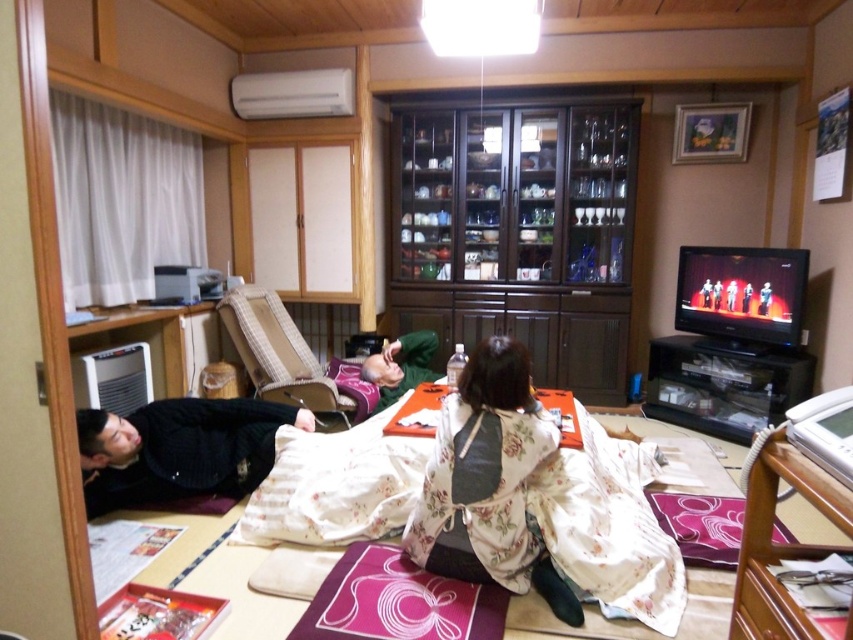
You are a guest in this room and want to sit between the two people wearing the floral silk kimono at center and the green matte kimono at center. Is there enough space between them for you to sit comfortably?

The floral silk kimono at center is positioned on the right side of the green matte kimono at center, so there is space between them for you to sit comfortably between the two.

You are organizing a space in the living room and need to place a new decorative item. The item is larger than the floral silk kimono at center but smaller than the dark wood cabinet at center. Where would be the most appropriate spot to place it?

The most appropriate spot would be near the dark wood cabinet at center since the item is smaller than it but larger than the floral silk kimono at center, ensuring proper scaling and balance in the room.

From the picture: You are a tailor who needs to determine which kimono requires more fabric to make between the floral silk kimono at center and the green matte kimono at center. Which one would you choose?

The floral silk kimono at center requires more fabric because its width is larger than the green matte kimono at center.